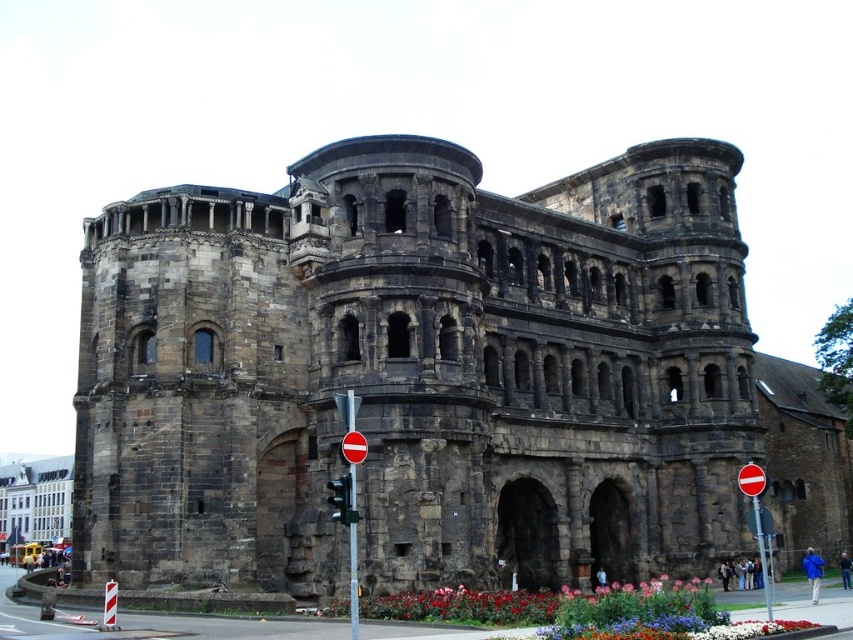
Is rustic stone building at center closer to the viewer compared to red plastic sign at center?

No, it is not.

Does rustic stone building at center have a lesser height compared to red plastic sign at center?

In fact, rustic stone building at center may be taller than red plastic sign at center.

Identify the location of rustic stone building at center. (416, 372).

Is red plastic sign at center wider than red glass traffic light at center?

Yes, red plastic sign at center is wider than red glass traffic light at center.

Looking at this image, who is positioned more to the left, red plastic sign at center or red glass traffic light at center?

red glass traffic light at center is more to the left.

Measure the distance between point (753, 500) and camera.

Point (753, 500) and camera are 65.56 meters apart.

Where is `red plastic sign at center`? Image resolution: width=853 pixels, height=640 pixels. red plastic sign at center is located at coordinates (756, 518).

Between point (74, 548) and point (334, 515), which one is positioned behind?

Positioned behind is point (74, 548).

Which of these two, rustic stone building at center or red glass traffic light at center, stands taller?

Standing taller between the two is rustic stone building at center.

Is point (221, 477) less distant than point (334, 499)?

No, (221, 477) is further to viewer.

Where is `rustic stone building at center`? rustic stone building at center is located at coordinates (416, 372).